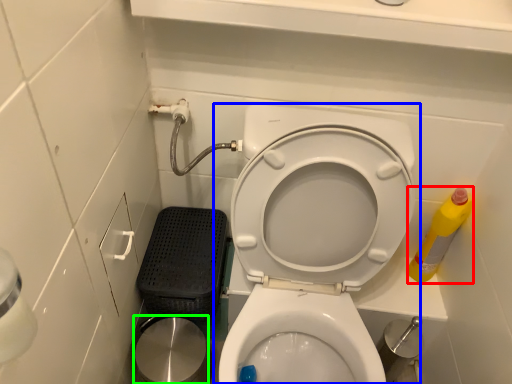
Question: Which object is the closest to the cleaning product (highlighted by a red box)? Choose among these: toilet (highlighted by a blue box) or potty (highlighted by a green box).

Choices:
 (A) toilet
 (B) potty

Answer: (A)